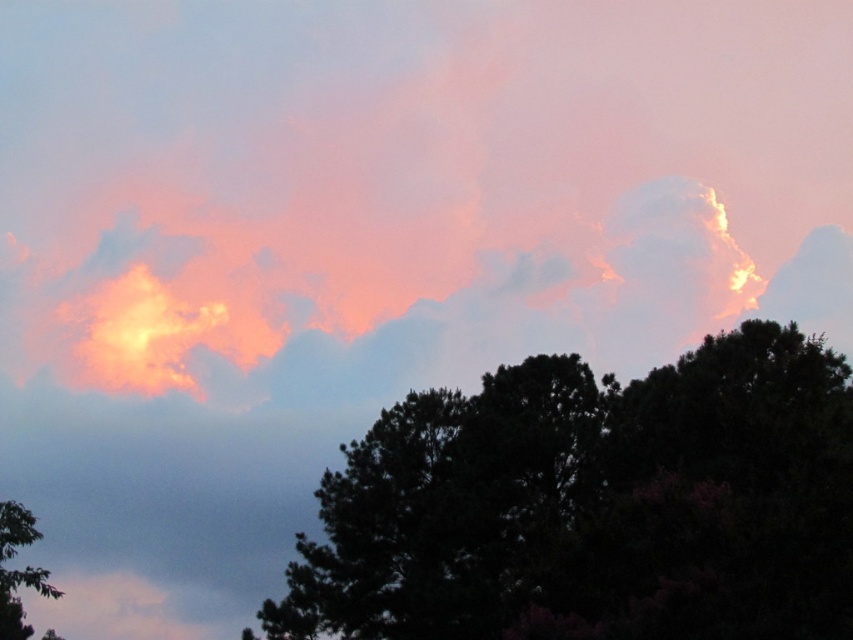
Between point (566, 621) and point (4, 573), which one is positioned behind?

Positioned behind is point (566, 621).

Can you confirm if dark green leafy tree at center is taller than green leafy tree at lower left?

Incorrect, dark green leafy tree at center's height is not larger of green leafy tree at lower left's.

Which is in front, point (796, 609) or point (16, 577)?

Point (16, 577) is in front.

Where is `dark green leafy tree at center`? The width and height of the screenshot is (853, 640). dark green leafy tree at center is located at coordinates (595, 506).